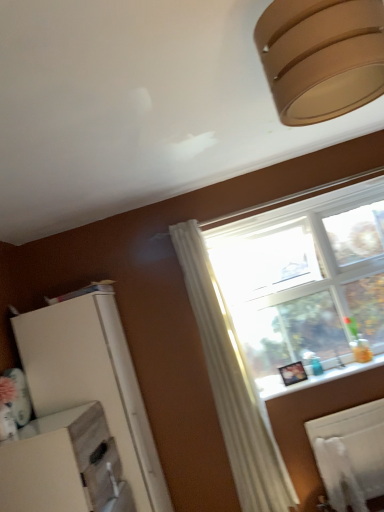
Question: From a real-world perspective, is matte brown lampshade at upper right physically located above or below white matte dresser at lower left?

Choices:
 (A) above
 (B) below

Answer: (A)

Question: Which is correct: matte brown lampshade at upper right is inside white matte dresser at lower left, or outside of it?

Choices:
 (A) outside
 (B) inside

Answer: (A)

Question: Which object is positioned farthest from the matte brown lampshade at upper right?

Choices:
 (A) white glossy window sill at lower right
 (B) white matte radiator at lower right
 (C) white matte dresser at lower left

Answer: (B)

Question: Based on their relative distances, which object is farther from the white matte radiator at lower right?

Choices:
 (A) white matte dresser at lower left
 (B) white glossy window sill at lower right
 (C) matte brown lampshade at upper right

Answer: (C)